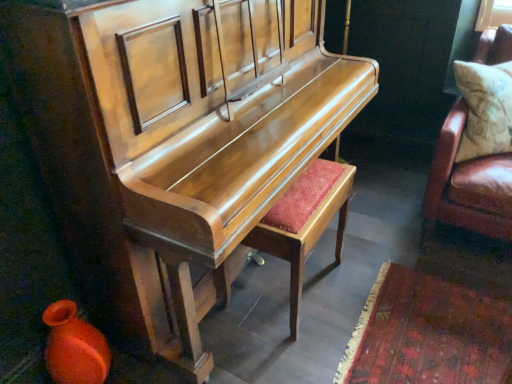
Where is `matte orange vase at lower left`? This screenshot has width=512, height=384. matte orange vase at lower left is located at coordinates (74, 347).

What do you see at coordinates (305, 222) in the screenshot?
I see `matte wood stool at center` at bounding box center [305, 222].

Measure the distance between point (501, 31) and camera.

The distance of point (501, 31) from camera is 1.98 meters.

Where is `matte orange vase at lower left`? The width and height of the screenshot is (512, 384). matte orange vase at lower left is located at coordinates (74, 347).

How different are the orientations of matte orange vase at lower left and leather cushion at right, placed as the first furniture when sorted from right to left, in degrees?

There is a 44.2-degree angle between the facing directions of matte orange vase at lower left and leather cushion at right, placed as the first furniture when sorted from right to left.

From the picture: Considering the relative positions of matte orange vase at lower left and leather cushion at right, placed as the first furniture when sorted from right to left, in the image provided, is matte orange vase at lower left to the left of leather cushion at right, placed as the first furniture when sorted from right to left, from the viewer's perspective?

Correct, you'll find matte orange vase at lower left to the left of leather cushion at right, placed as the first furniture when sorted from right to left.

What are the coordinates of `furniture behind the matte orange vase at lower left` in the screenshot? It's located at 467,186.

Between point (94, 339) and point (442, 131), which one is positioned behind?

Positioned behind is point (442, 131).

Considering the positions of points (52, 89) and (248, 234), is point (52, 89) farther from camera compared to point (248, 234)?

No, it is in front of (248, 234).

From the picture: Considering the relative sizes of shiny wood piano at center, the 2th furniture when ordered from right to left, and matte wood stool at center in the image provided, is shiny wood piano at center, the 2th furniture when ordered from right to left, bigger than matte wood stool at center?

Yes.

Is shiny wood piano at center, the 2th furniture when ordered from right to left, closer to camera compared to matte wood stool at center?

Yes, shiny wood piano at center, the 2th furniture when ordered from right to left, is closer to the viewer.

Can you see shiny wood piano at center, the 2th furniture when ordered from right to left, touching matte wood stool at center?

shiny wood piano at center, the 2th furniture when ordered from right to left, and matte wood stool at center are not in contact.

Is leather cushion at right, positioned as the 2th furniture in left-to-right order, aimed at matte wood stool at center?

No.

From the image's perspective, which is above, leather cushion at right, placed as the first furniture when sorted from right to left, or matte wood stool at center?

leather cushion at right, placed as the first furniture when sorted from right to left.

How different are the orientations of leather cushion at right, positioned as the 2th furniture in left-to-right order, and matte wood stool at center in degrees?

There is a 136-degree angle between the facing directions of leather cushion at right, positioned as the 2th furniture in left-to-right order, and matte wood stool at center.

The height and width of the screenshot is (384, 512). I want to click on the 1st furniture located above the matte wood stool at center (from a real-world perspective), so pyautogui.click(x=467, y=186).

Consider the image. Could you tell me if matte orange vase at lower left is turned towards shiny wood piano at center, the 2th furniture when ordered from right to left?

No.

Is point (70, 345) positioned after point (96, 124)?

That is True.

Which is correct: matte wood stool at center is inside shiny wood piano at center, which ranks as the first furniture in left-to-right order, or outside of it?

matte wood stool at center lies within the bounds of shiny wood piano at center, which ranks as the first furniture in left-to-right order.

Considering the relative positions of matte wood stool at center and shiny wood piano at center, which ranks as the first furniture in left-to-right order, in the image provided, is matte wood stool at center behind shiny wood piano at center, which ranks as the first furniture in left-to-right order,?

Yes.

Is matte wood stool at center taller than shiny wood piano at center, the 2th furniture when ordered from right to left?

In fact, matte wood stool at center may be shorter than shiny wood piano at center, the 2th furniture when ordered from right to left.

Is matte wood stool at center far from shiny wood piano at center, which ranks as the first furniture in left-to-right order?

No, there isn't a large distance between matte wood stool at center and shiny wood piano at center, which ranks as the first furniture in left-to-right order.

At what (x,y) coordinates should I click in order to perform the action: click on stool behind the matte orange vase at lower left. Please return your answer as a coordinate pair (x, y). The width and height of the screenshot is (512, 384). Looking at the image, I should click on (305, 222).

Does matte orange vase at lower left have a lesser height compared to matte wood stool at center?

Indeed, matte orange vase at lower left has a lesser height compared to matte wood stool at center.

From a real-world perspective, is matte orange vase at lower left on matte wood stool at center?

No, from a real-world perspective, matte orange vase at lower left is not on top of matte wood stool at center.

Can you tell me how much matte orange vase at lower left and matte wood stool at center differ in facing direction?

180 degrees separate the facing orientations of matte orange vase at lower left and matte wood stool at center.

From a real-world perspective, is shiny wood piano at center, which ranks as the first furniture in left-to-right order, physically above leather cushion at right, placed as the first furniture when sorted from right to left?

Correct, in the physical world, shiny wood piano at center, which ranks as the first furniture in left-to-right order, is higher than leather cushion at right, placed as the first furniture when sorted from right to left.

Does shiny wood piano at center, the 2th furniture when ordered from right to left, appear on the right side of leather cushion at right, positioned as the 2th furniture in left-to-right order?

No.

Consider the image. Is shiny wood piano at center, which ranks as the first furniture in left-to-right order, with leather cushion at right, placed as the first furniture when sorted from right to left?

No.

How different are the orientations of shiny wood piano at center, the 2th furniture when ordered from right to left, and leather cushion at right, placed as the first furniture when sorted from right to left, in degrees?

There is a 43.9-degree angle between the facing directions of shiny wood piano at center, the 2th furniture when ordered from right to left, and leather cushion at right, placed as the first furniture when sorted from right to left.

You are a GUI agent. You are given a task and a screenshot of the screen. Output one action in this format:
    pyautogui.click(x=<x>, y=<y>)
    Task: Click on the vase below the leather cushion at right, placed as the first furniture when sorted from right to left (from the image's perspective)
    
    Given the screenshot: What is the action you would take?
    pyautogui.click(x=74, y=347)

Where is `furniture that is the 1st object located above the matte wood stool at center (from the image's perspective)`? This screenshot has width=512, height=384. furniture that is the 1st object located above the matte wood stool at center (from the image's perspective) is located at coordinates (175, 140).

Considering their positions, is matte orange vase at lower left positioned closer to matte wood stool at center than shiny wood piano at center, which ranks as the first furniture in left-to-right order?

shiny wood piano at center, which ranks as the first furniture in left-to-right order, is positioned closer to the anchor matte wood stool at center.

From the image, which object appears to be nearer to shiny wood piano at center, which ranks as the first furniture in left-to-right order, leather cushion at right, placed as the first furniture when sorted from right to left, or matte wood stool at center?

matte wood stool at center is closer to shiny wood piano at center, which ranks as the first furniture in left-to-right order.

Estimate the real-world distances between objects in this image. Which object is closer to leather cushion at right, positioned as the 2th furniture in left-to-right order, shiny wood piano at center, the 2th furniture when ordered from right to left, or matte wood stool at center?

matte wood stool at center lies closer to leather cushion at right, positioned as the 2th furniture in left-to-right order, than the other object.

Looking at the image, which one is located further to matte orange vase at lower left, shiny wood piano at center, the 2th furniture when ordered from right to left, or leather cushion at right, placed as the first furniture when sorted from right to left?

leather cushion at right, placed as the first furniture when sorted from right to left.

Considering their positions, is shiny wood piano at center, the 2th furniture when ordered from right to left, positioned closer to matte orange vase at lower left than matte wood stool at center?

Based on the image, shiny wood piano at center, the 2th furniture when ordered from right to left, appears to be nearer to matte orange vase at lower left.

From the image, which object appears to be farther from shiny wood piano at center, the 2th furniture when ordered from right to left, matte wood stool at center or leather cushion at right, placed as the first furniture when sorted from right to left?

Based on the image, leather cushion at right, placed as the first furniture when sorted from right to left, appears to be further to shiny wood piano at center, the 2th furniture when ordered from right to left.

Based on their spatial positions, is leather cushion at right, positioned as the 2th furniture in left-to-right order, or matte orange vase at lower left closer to matte wood stool at center?

leather cushion at right, positioned as the 2th furniture in left-to-right order.

Which object lies further to the anchor point matte wood stool at center, shiny wood piano at center, which ranks as the first furniture in left-to-right order, or matte orange vase at lower left?

The object further to matte wood stool at center is matte orange vase at lower left.

Find the location of a particular element. This screenshot has height=384, width=512. stool between matte orange vase at lower left and leather cushion at right, positioned as the 2th furniture in left-to-right order, in the horizontal direction is located at coordinates (305, 222).

At what (x,y) coordinates should I click in order to perform the action: click on furniture located between matte orange vase at lower left and leather cushion at right, positioned as the 2th furniture in left-to-right order, in the left-right direction. Please return your answer as a coordinate pair (x, y). The width and height of the screenshot is (512, 384). Looking at the image, I should click on pos(175,140).

The height and width of the screenshot is (384, 512). Identify the location of furniture between matte orange vase at lower left and matte wood stool at center in the horizontal direction. (175, 140).

What are the coordinates of `stool between shiny wood piano at center, the 2th furniture when ordered from right to left, and leather cushion at right, positioned as the 2th furniture in left-to-right order, in the horizontal direction` in the screenshot? It's located at (305, 222).